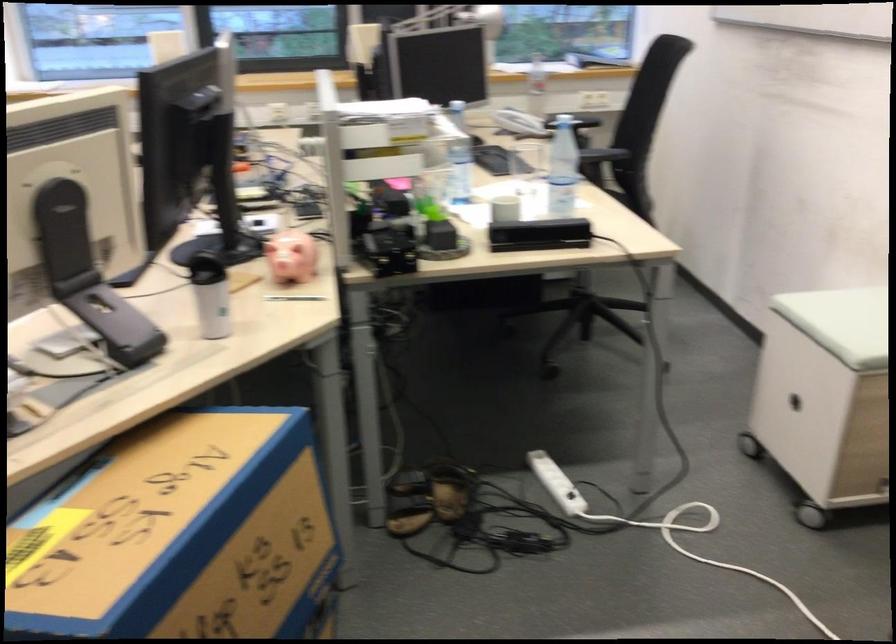
The height and width of the screenshot is (644, 896). What do you see at coordinates (796, 402) in the screenshot?
I see `the stool handle hole` at bounding box center [796, 402].